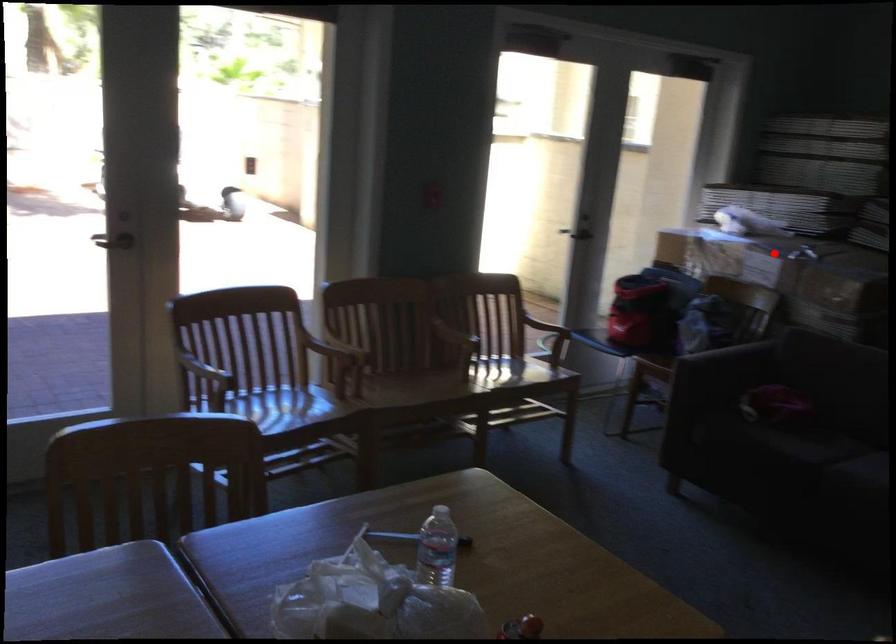
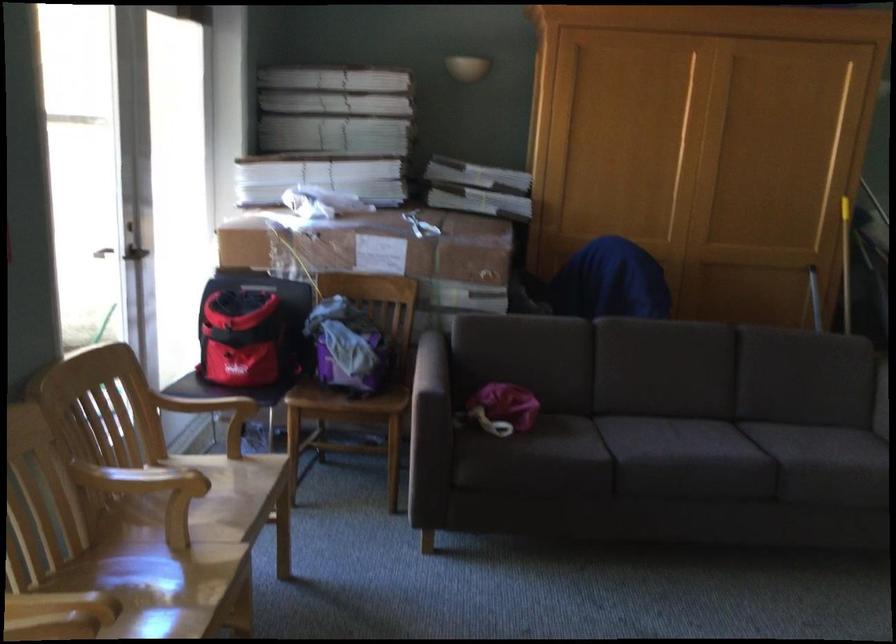
Question: I am providing you with two images of the same scene from different viewpoints. In image1, a red point is highlighted. Considering the same 3D point in image2, which of the following is correct?

Choices:
 (A) It is closer
 (B) It is farther

Answer: (A)